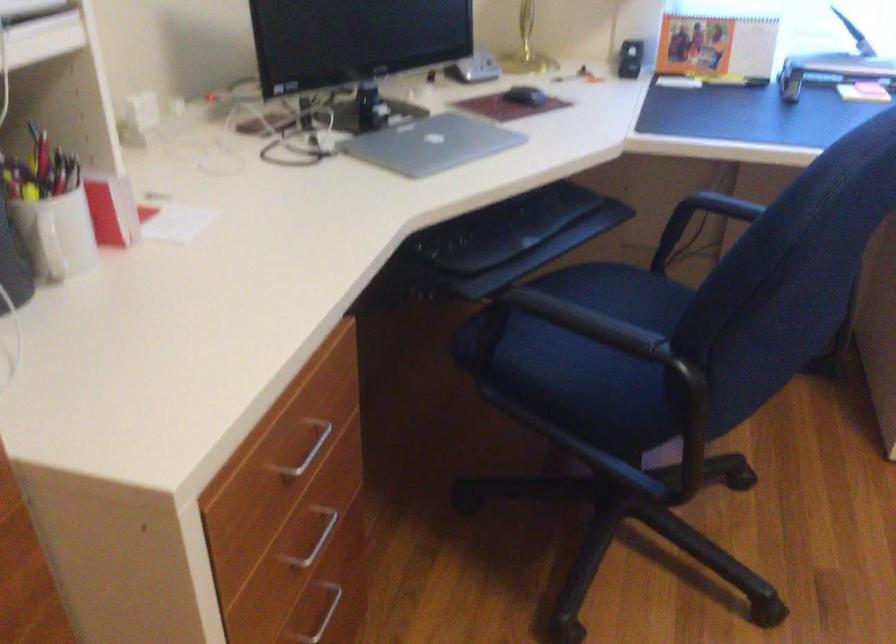
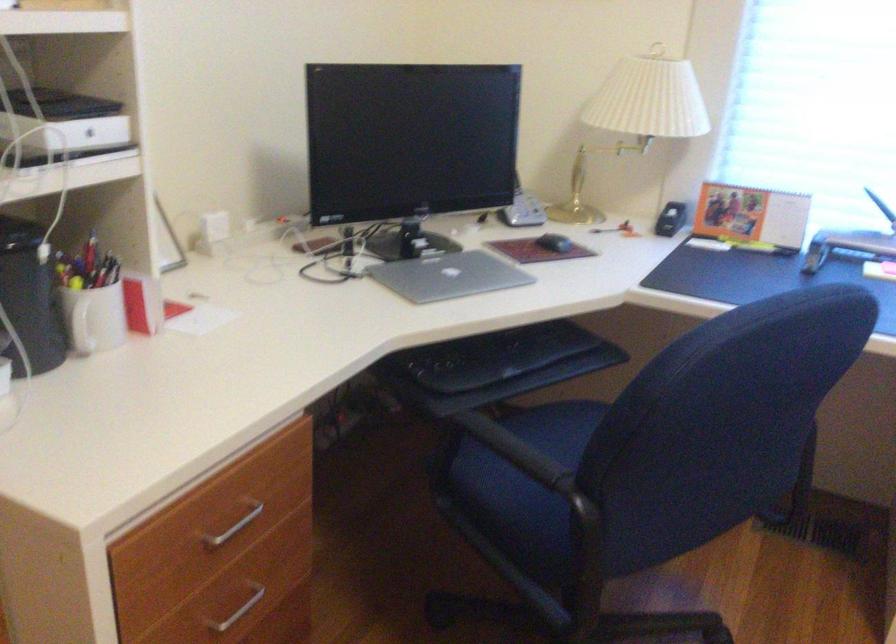
Where in the second image is the point corresponding to [435,144] from the first image?

(449, 276)